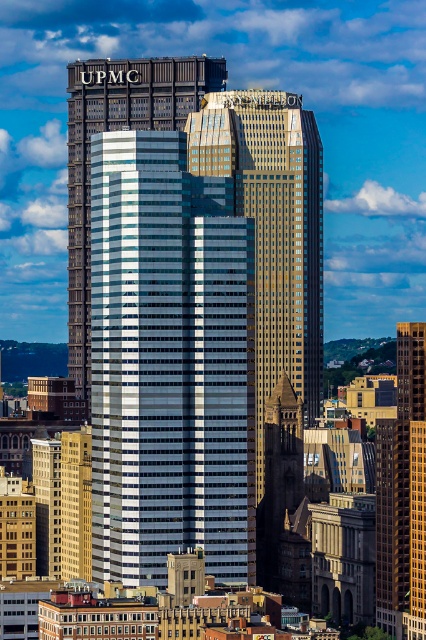
You are standing at the base of the UPMC building and want to reach the PNC Plaza building. The point at coordinates [250,337] is 2131.53 feet away from you. Is this point closer to the UPMC building or the PNC Plaza building?

The point at coordinates [250,337] is 2131.53 feet from the viewer, which is closer to the UPMC building since it is the shorter one and the PNC Plaza is taller and likely further away.

You are standing in the middle of the city park and looking at the two skyscrapers in front of you. Which one is taller between the metallic glass skyscraper at center and the white glass skyscraper at center?

The metallic glass skyscraper at center is much taller than the white glass skyscraper at center.